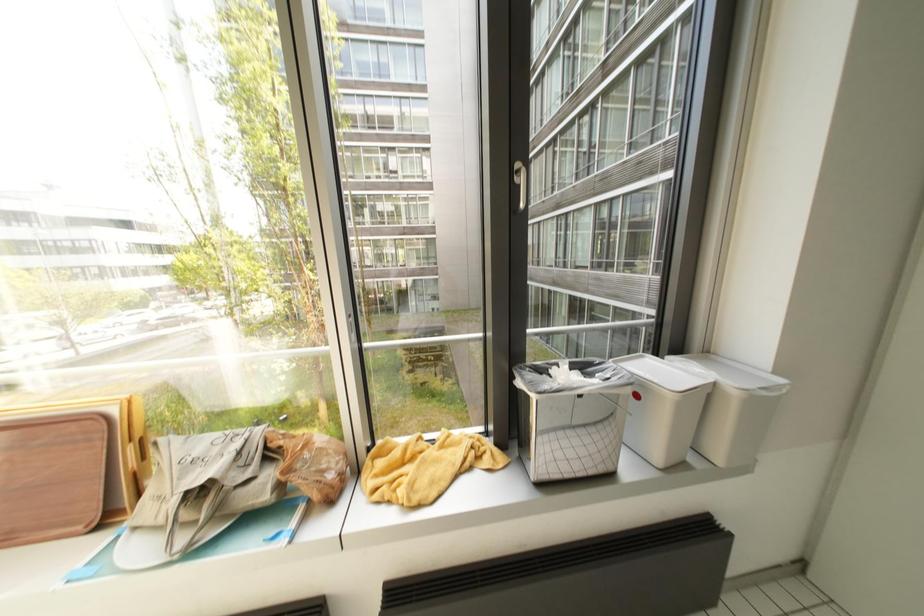
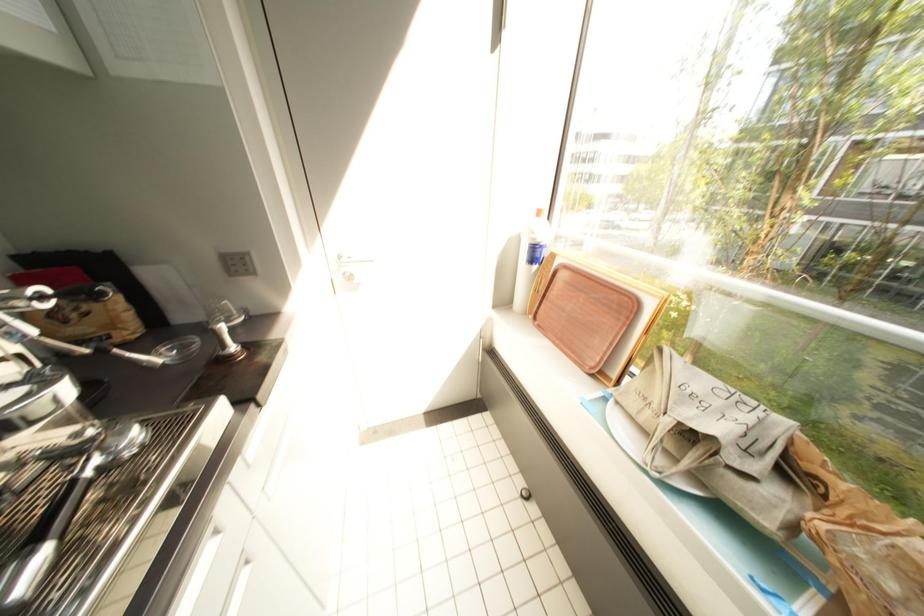
First-person continuous shooting, in which direction is the camera rotating?

The camera rotated toward left-down.